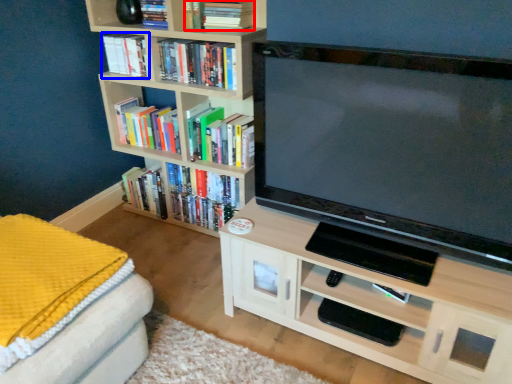
Question: Which of the following is the farthest to the observer, book (highlighted by a red box) or book (highlighted by a blue box)?

Choices:
 (A) book
 (B) book

Answer: (B)